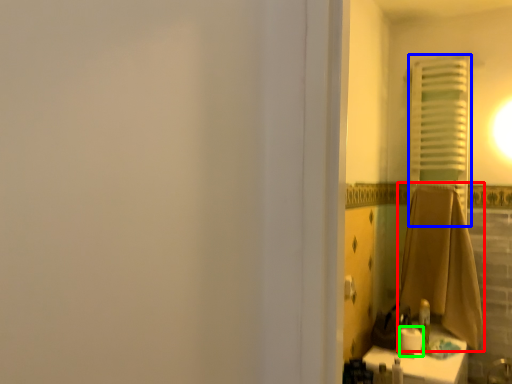
Question: Estimate the real-world distances between objects in this image. Which object is farther from bath towel (highlighted by a red box), curtain (highlighted by a blue box) or toilet paper (highlighted by a green box)?

Choices:
 (A) curtain
 (B) toilet paper

Answer: (B)